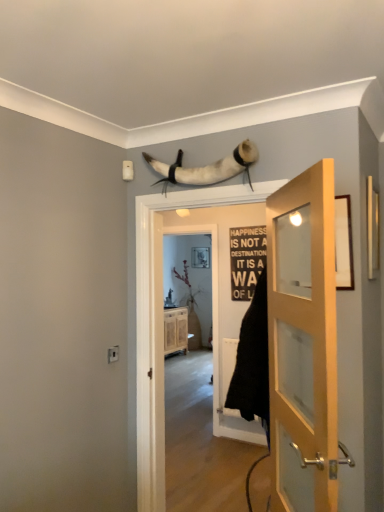
Question: Is wooden door at right, the second door in the left-to-right sequence, taller or shorter than white leather horns at upper center?

Choices:
 (A) tall
 (B) short

Answer: (A)

Question: Choose the correct answer: Is wooden door at right, marked as the first door in a front-to-back arrangement, inside white leather horns at upper center or outside it?

Choices:
 (A) inside
 (B) outside

Answer: (B)

Question: Estimate the real-world distances between objects in this image. Which object is closer to the wooden cabinet at center?

Choices:
 (A) white leather horns at upper center
 (B) matte black picture frame at upper center
 (C) wooden door at right, which is counted as the 2th door, starting from the back
 (D) white wooden door at center, which is the second door in front-to-back order

Answer: (B)

Question: Estimate the real-world distances between objects in this image. Which object is closer to the wooden door at right, placed as the first door when sorted from right to left?

Choices:
 (A) matte black picture frame at upper center
 (B) white wooden door at center, the 2th door when ordered from right to left
 (C) wooden cabinet at center
 (D) white leather horns at upper center

Answer: (B)